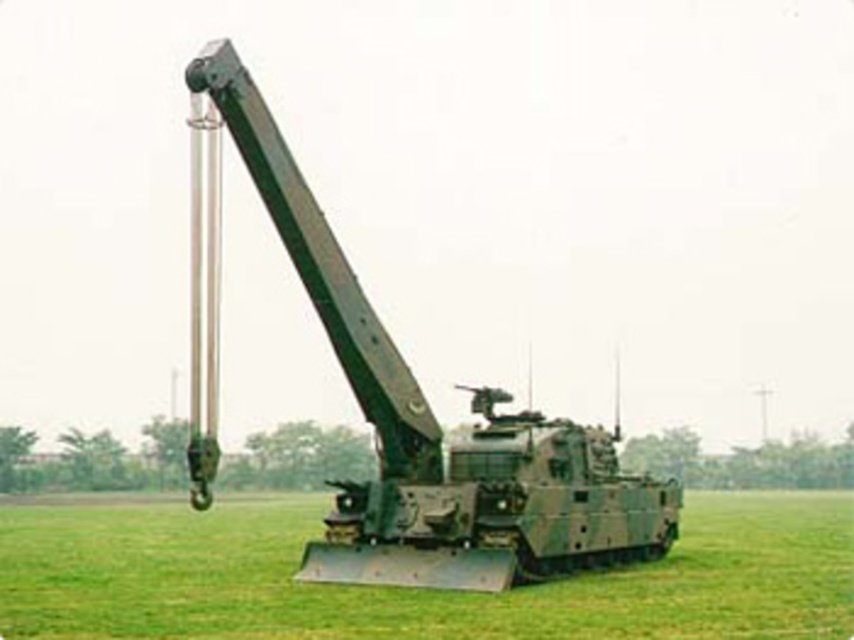
You are a military engineer assessing the terrain. The green matte grass at center and the camouflage metal tank at center are both in your line of sight. Which object occupies a wider area in the scene?

The green matte grass at center occupies a wider area in the scene since its width is larger than that of the camouflage metal tank at center.

You are a soldier positioned at the rear of the military vehicle. You need to move to a point that is in front of another point. Which point should you move to first, point [535,614] or point [369,522]?

Point [535,614] is in front of point [369,522], so you should move to point [535,614] first.

You are a soldier who needs to move a heavy crate from the ground to the top of the camouflage metal tank at center. The green matte grass at center is in the way. Can you move the crate directly over the grass without stepping on it?

The green matte grass at center is to the left of camouflage metal tank at center, so you can move the crate directly over the grass by lifting it from the right side of the tank, avoiding the grass area.